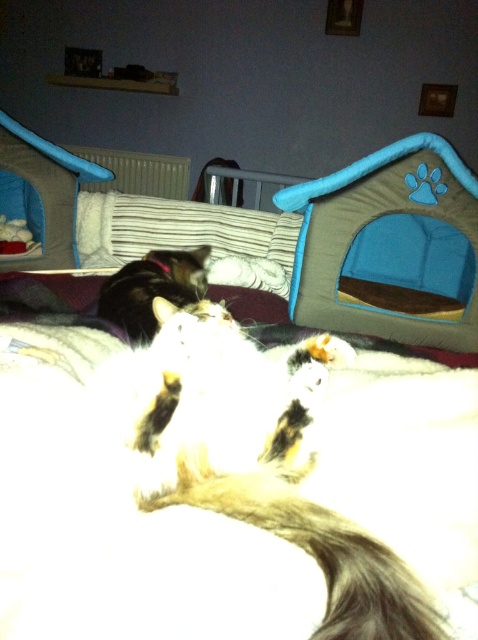
Which of these two, white fluffy cat at center or brown fuzzy tail at center, stands shorter?

With less height is brown fuzzy tail at center.

Who is more distant from viewer, (x=322, y=556) or (x=289, y=502)?

The point (x=289, y=502) is behind.

Does point (170, 484) come farther from viewer compared to point (421, 602)?

Yes, point (170, 484) is behind point (421, 602).

Find the location of a particular element. white fluffy cat at center is located at coordinates (256, 460).

Can you confirm if blue fabric pet house at right is taller than brown fuzzy tail at center?

Yes, blue fabric pet house at right is taller than brown fuzzy tail at center.

Is blue fabric pet house at right thinner than brown fuzzy tail at center?

No.

Which is in front, point (321, 211) or point (302, 540)?

Point (302, 540) is more forward.

Where is `blue fabric pet house at right`? This screenshot has width=478, height=640. blue fabric pet house at right is located at coordinates (390, 246).

Is white fluffy cat at center taller than fluffy black cat at center?

Incorrect, white fluffy cat at center's height is not larger of fluffy black cat at center's.

This screenshot has width=478, height=640. I want to click on white fluffy cat at center, so click(256, 460).